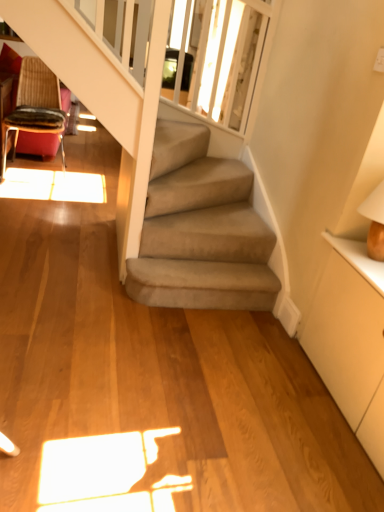
What do you see at coordinates (36, 106) in the screenshot?
I see `wooden textured chair at upper left` at bounding box center [36, 106].

At what (x,y) coordinates should I click in order to perform the action: click on translucent glass window screen at upper center. Please return your answer as a coordinate pair (x, y). Looking at the image, I should click on (232, 60).

Would you say translucent glass window screen at upper center is outside wooden textured chair at upper left?

That's correct, translucent glass window screen at upper center is outside of wooden textured chair at upper left.

Is translucent glass window screen at upper center wider than wooden textured chair at upper left?

No.

From the image's perspective, is translucent glass window screen at upper center under wooden textured chair at upper left?

Actually, translucent glass window screen at upper center appears above wooden textured chair at upper left in the image.

Is translucent glass window screen at upper center oriented towards wooden textured chair at upper left?

No, translucent glass window screen at upper center is not turned towards wooden textured chair at upper left.

In the scene shown: From a real-world perspective, is white matte dresser at right positioned over wooden textured chair at upper left based on gravity?

No, from a real-world perspective, white matte dresser at right is not over wooden textured chair at upper left

Is white matte dresser at right bigger or smaller than wooden textured chair at upper left?

Considering their sizes, white matte dresser at right takes up less space than wooden textured chair at upper left.

Considering the relative sizes of white matte dresser at right and wooden textured chair at upper left in the image provided, is white matte dresser at right taller than wooden textured chair at upper left?

In fact, white matte dresser at right may be shorter than wooden textured chair at upper left.

Is white matte dresser at right in contact with wooden textured chair at upper left?

They are not placed beside each other.

Who is more distant, wooden textured chair at upper left or white matte dresser at right?

wooden textured chair at upper left is more distant.

Would you say wooden textured chair at upper left is inside or outside white matte dresser at right?

wooden textured chair at upper left lies outside white matte dresser at right.

Which of these two, wooden textured chair at upper left or white matte dresser at right, is wider?

With larger width is wooden textured chair at upper left.

Locate an element on the screen. The height and width of the screenshot is (512, 384). dresser below the wooden textured chair at upper left (from a real-world perspective) is located at coordinates (351, 340).

From the image's perspective, is white matte dresser at right beneath translucent glass window screen at upper center?

Yes, from the image's perspective, white matte dresser at right is below translucent glass window screen at upper center.

Who is more distant, white matte dresser at right or translucent glass window screen at upper center?

translucent glass window screen at upper center.

From a real-world perspective, who is located lower, white matte dresser at right or translucent glass window screen at upper center?

white matte dresser at right is physically lower.

Is wooden textured chair at upper left positioned far away from translucent glass window screen at upper center?

Yes, wooden textured chair at upper left and translucent glass window screen at upper center are located far from each other.

From the picture: From a real-world perspective, is wooden textured chair at upper left under translucent glass window screen at upper center?

Correct, in the physical world, wooden textured chair at upper left is lower than translucent glass window screen at upper center.

Can you confirm if wooden textured chair at upper left is taller than translucent glass window screen at upper center?

No, wooden textured chair at upper left is not taller than translucent glass window screen at upper center.

Does translucent glass window screen at upper center touch white matte dresser at right?

No, translucent glass window screen at upper center is not touching white matte dresser at right.

Is translucent glass window screen at upper center facing away from white matte dresser at right?

translucent glass window screen at upper center does not have its back to white matte dresser at right.

Who is bigger, translucent glass window screen at upper center or white matte dresser at right?

white matte dresser at right.

What are the coordinates of `window screen on the left of white matte dresser at right` in the screenshot? It's located at (232, 60).

Identify the location of window screen above the wooden textured chair at upper left (from the image's perspective). This screenshot has height=512, width=384. (232, 60).

Image resolution: width=384 pixels, height=512 pixels. I want to click on dresser below the wooden textured chair at upper left (from a real-world perspective), so click(x=351, y=340).

Considering their positions, is translucent glass window screen at upper center positioned closer to wooden textured chair at upper left than white matte dresser at right?

Based on the image, translucent glass window screen at upper center appears to be nearer to wooden textured chair at upper left.

From the image, which object appears to be nearer to white matte dresser at right, translucent glass window screen at upper center or wooden textured chair at upper left?

Based on the image, translucent glass window screen at upper center appears to be nearer to white matte dresser at right.

Considering their positions, is wooden textured chair at upper left positioned closer to white matte dresser at right than translucent glass window screen at upper center?

translucent glass window screen at upper center.

Estimate the real-world distances between objects in this image. Which object is further from wooden textured chair at upper left, white matte dresser at right or translucent glass window screen at upper center?

white matte dresser at right lies further to wooden textured chair at upper left than the other object.

Looking at the image, which one is located further to translucent glass window screen at upper center, wooden textured chair at upper left or white matte dresser at right?

white matte dresser at right.

Based on the photo, estimate the real-world distances between objects in this image. Which object is further from translucent glass window screen at upper center, white matte dresser at right or wooden textured chair at upper left?

white matte dresser at right.

In order to click on window screen located between wooden textured chair at upper left and white matte dresser at right in the left-right direction in this screenshot , I will do `click(232, 60)`.